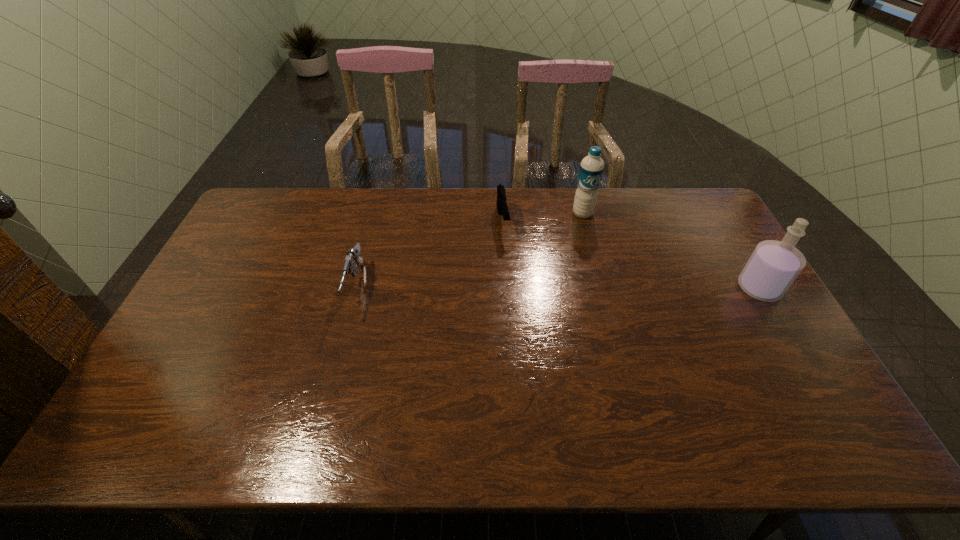
Locate an element on the screen. This screenshot has height=540, width=960. vacant region located 0.270m on the label of the second object from right to left is located at coordinates (608, 274).

The image size is (960, 540). Find the location of `free space located 0.170m on the label of the second object from right to left`. free space located 0.170m on the label of the second object from right to left is located at coordinates (599, 253).

Where is `pistol at the far edge`? pistol at the far edge is located at coordinates (502, 208).

Where is `water bottle at the far edge`? This screenshot has width=960, height=540. water bottle at the far edge is located at coordinates (591, 169).

Identify the location of object located at the right edge. (774, 265).

Image resolution: width=960 pixels, height=540 pixels. In the image, there is a desktop. Find the location of `vacant space at the far edge`. vacant space at the far edge is located at coordinates (669, 228).

This screenshot has width=960, height=540. I want to click on vacant space at the near edge of the desktop, so click(396, 404).

I want to click on free region at the right edge, so click(719, 289).

Identify the location of vacant region at the far right corner of the desktop. (706, 212).

Identify the location of vacant space at the near right corner of the desktop. (770, 387).